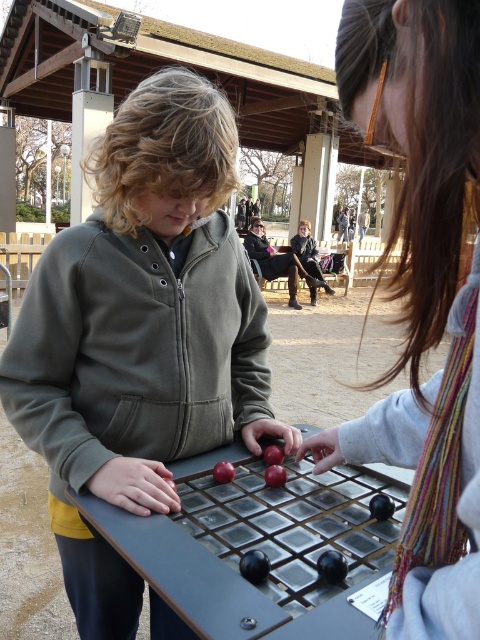
You are standing in the park and want to greet the person wearing the multicolored scarf at center. Which direction should you move relative to the matte green jacket at center?

You should move away from the matte green jacket at center towards the multicolored scarf at center since the matte green jacket at center is closer to you than the multicolored scarf at center.

You are a delivery robot with a 16 inch wide package. You need to move between the matte green jacket at center and the multicolored scarf at center. Can you fit through the space between them?

The distance between the matte green jacket at center and the multicolored scarf at center is 17.51 inches. Since your package is 16 inches wide, you can fit through the space between them as 16 is less than 17.51.

You are a photographer trying to capture the multicolored scarf at center and the shiny black board game at center in a single photo. Based on their sizes, which object will appear larger in the photo?

The multicolored scarf at center will appear larger in the photo because it is much taller than the shiny black board game at center.